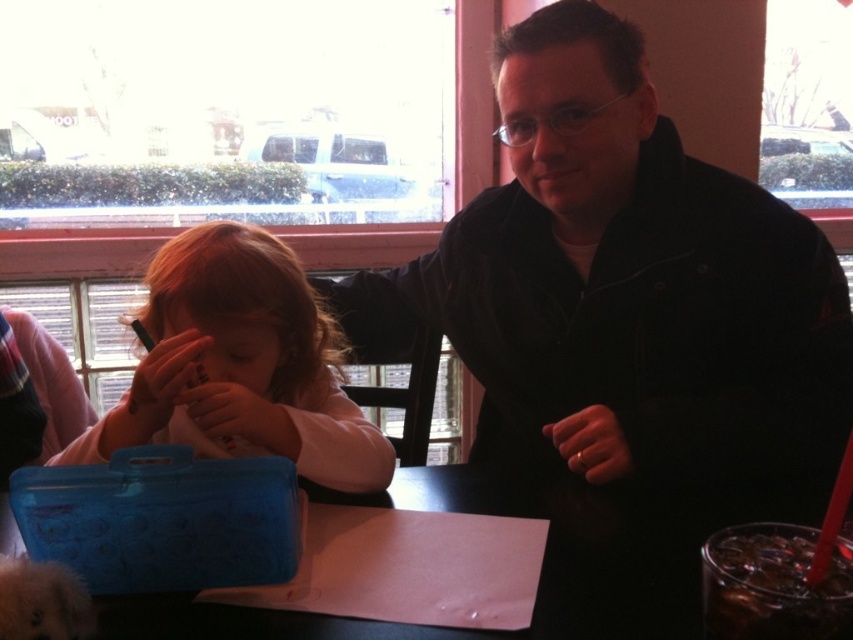
You are a customer at the cafe and want to place your phone on the table without it tipping into the drink. Which object, the matte blue pencil case at left or the clear glass drink at lower right, should you use as a stabilizer?

The matte blue pencil case at left is positioned over the clear glass drink at lower right, so you can use the matte blue pencil case at left to stabilize your phone and prevent it from tipping into the drink.

You are a server in a restaurant and need to place a large tray of food on the table. The tray is as big as the black glossy table at center. Will the matte white hand at center interfere with placing the tray?

The black glossy table at center is bigger than the matte white hand at center, so placing the tray the size of the table should be possible without the hand interfering as there is enough space.

You are taking a photo of the scene and want to focus on both point [219,442] and point [482,490]. Which point is closer to the camera?

Point [219,442] is closer to the camera than point [482,490].